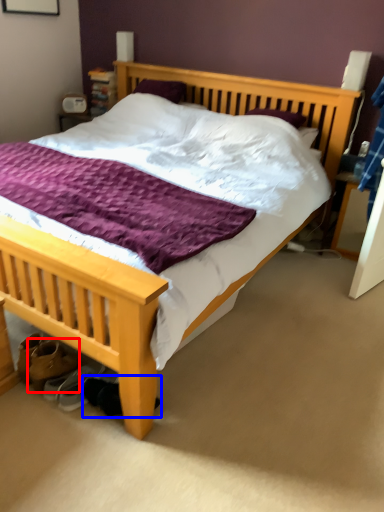
Question: Which point is closer to the camera, footwear (highlighted by a red box) or shoe (highlighted by a blue box)?

Choices:
 (A) footwear
 (B) shoe

Answer: (B)